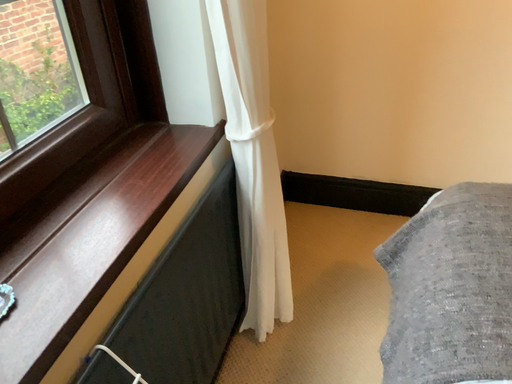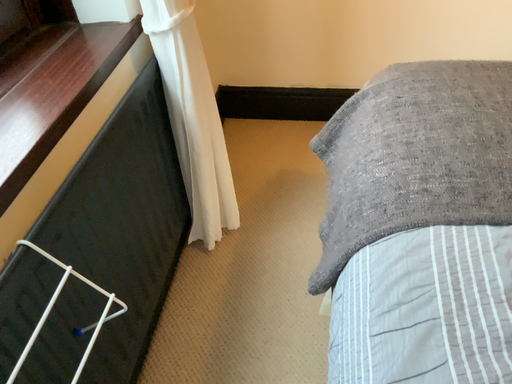
Question: How did the camera likely rotate when shooting the video?

Choices:
 (A) rotated left
 (B) rotated right

Answer: (B)